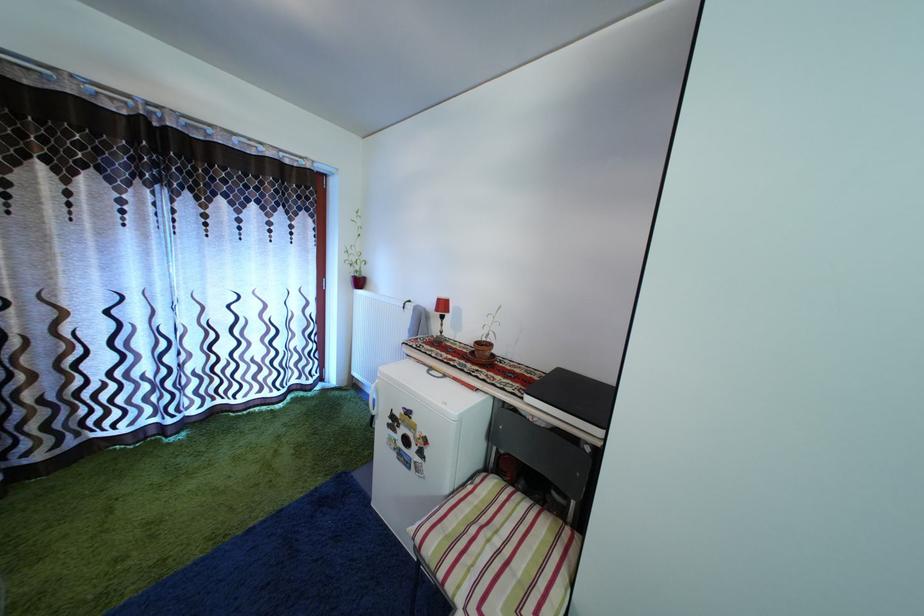
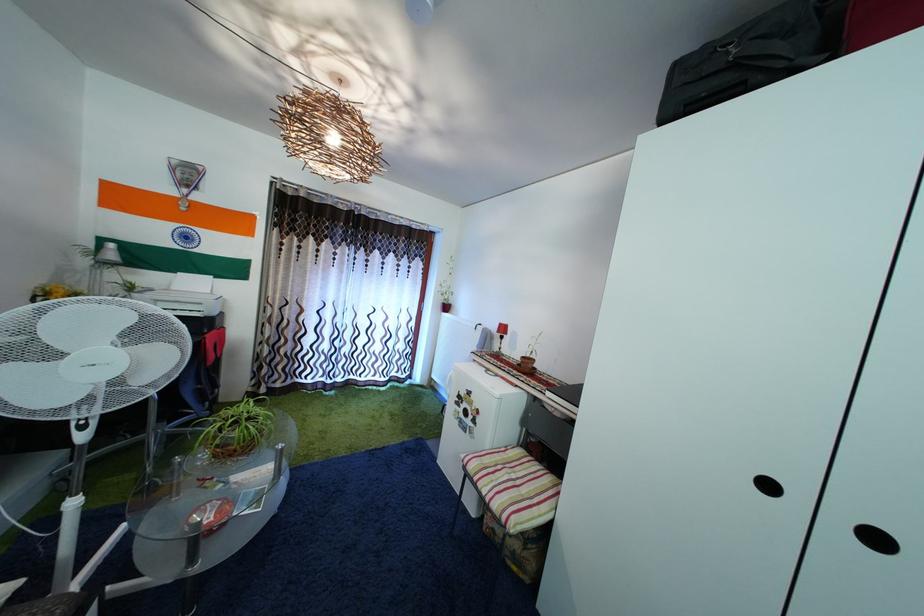
Question: The camera is either moving clockwise (left) or counter-clockwise (right) around the object. The first image is from the beginning of the video and the second image is from the end. Is the camera moving left or right when shooting the video?

Choices:
 (A) Left
 (B) Right

Answer: (B)